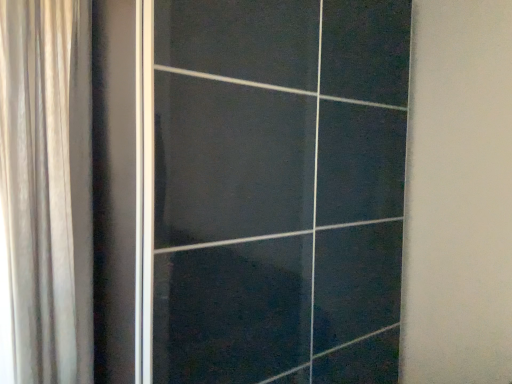
Question: Is silky beige curtain at left in front of or behind black glossy door at center in the image?

Choices:
 (A) front
 (B) behind

Answer: (B)

Question: In terms of width, does silky beige curtain at left look wider or thinner when compared to black glossy door at center?

Choices:
 (A) thin
 (B) wide

Answer: (A)

Question: From the image's perspective, is silky beige curtain at left located above or below black glossy door at center?

Choices:
 (A) below
 (B) above

Answer: (B)

Question: From the image's perspective, is black glossy door at center above or below silky beige curtain at left?

Choices:
 (A) above
 (B) below

Answer: (B)

Question: From a real-world perspective, relative to silky beige curtain at left, is black glossy door at center vertically above or below?

Choices:
 (A) above
 (B) below

Answer: (B)

Question: Visually, is black glossy door at center positioned to the left or to the right of silky beige curtain at left?

Choices:
 (A) right
 (B) left

Answer: (A)

Question: Is point (317, 337) positioned closer to the camera than point (62, 355)?

Choices:
 (A) closer
 (B) farther

Answer: (B)